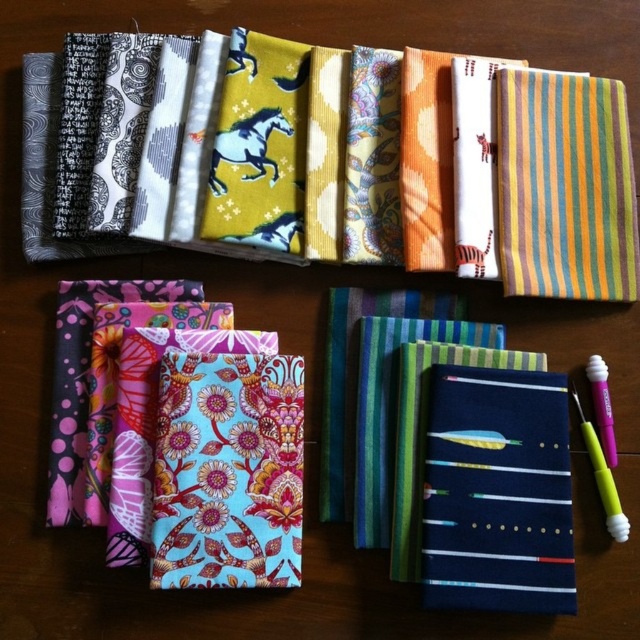
Which is below, navy blue fabric at center or translucent purple pen at lower right?

navy blue fabric at center

This screenshot has width=640, height=640. What do you see at coordinates (497, 492) in the screenshot?
I see `navy blue fabric at center` at bounding box center [497, 492].

Who is more forward, (518, 458) or (612, 451)?

Point (518, 458) is more forward.

I want to click on navy blue fabric at center, so pos(497,492).